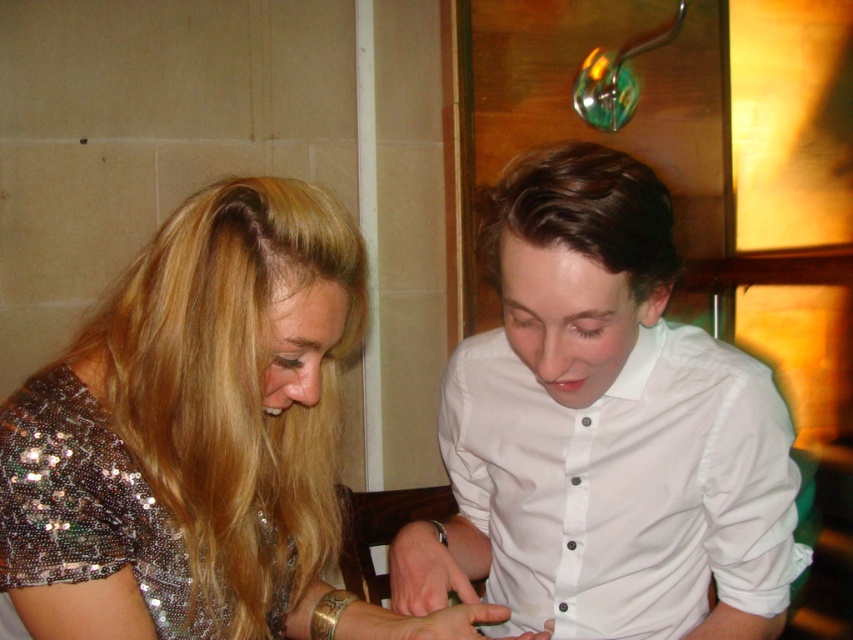
Locate an element on the screen. The height and width of the screenshot is (640, 853). white button-down shirt at center is located at coordinates (602, 432).

Where is `white button-down shirt at center`? white button-down shirt at center is located at coordinates (602, 432).

Who is higher up, shiny sequined dress at center or sparkly sequined dress at lower left?

shiny sequined dress at center is higher up.

What do you see at coordinates (210, 419) in the screenshot? The image size is (853, 640). I see `shiny sequined dress at center` at bounding box center [210, 419].

Is point (213, 390) positioned before point (155, 612)?

Yes, it is in front of point (155, 612).

At what (x,y) coordinates should I click in order to perform the action: click on shiny sequined dress at center. Please return your answer as a coordinate pair (x, y). The image size is (853, 640). Looking at the image, I should click on (210, 419).

Can you confirm if white button-down shirt at center is smaller than sparkly sequined dress at lower left?

No.

Who is lower down, white button-down shirt at center or sparkly sequined dress at lower left?

Positioned lower is sparkly sequined dress at lower left.

Which is behind, point (502, 483) or point (18, 420)?

The point (502, 483) is behind.

Image resolution: width=853 pixels, height=640 pixels. Find the location of `white button-down shirt at center`. white button-down shirt at center is located at coordinates (602, 432).